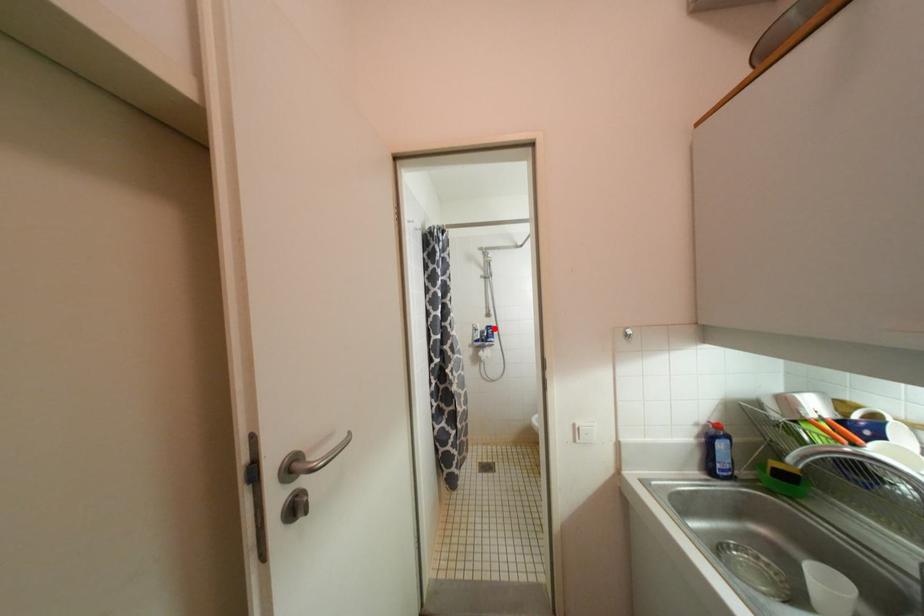
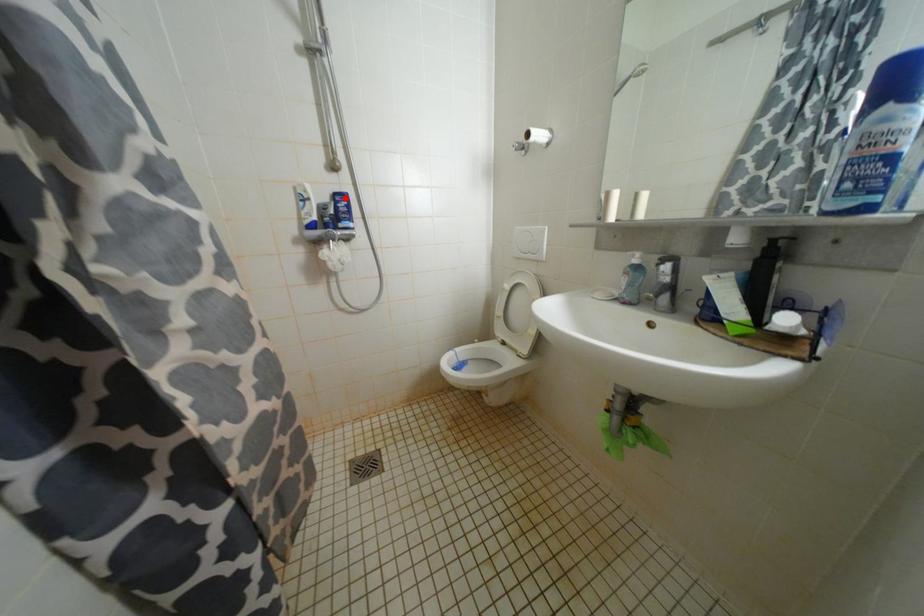
I am providing you with two images of the same scene from different viewpoints. A red point is marked on the first image and another point is marked on the second image. Is the red point in image1 aligned with the point shown in image2?

Yes